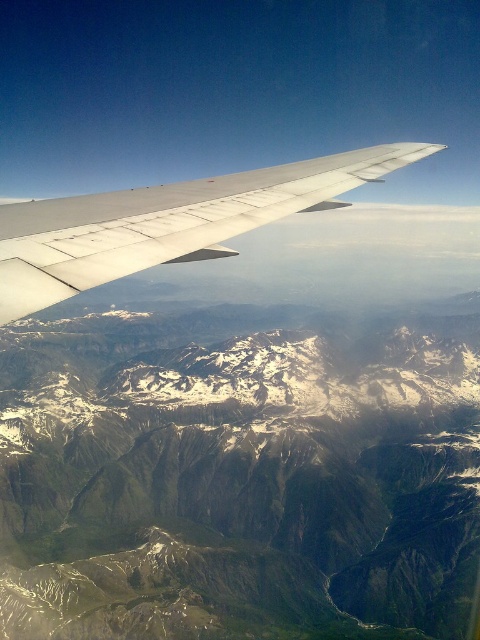
Which of these two, snowy rocky mountains at upper center or silver metallic wing at upper center, stands shorter?

silver metallic wing at upper center

Does point (201, 496) lie in front of point (144, 264)?

No, (201, 496) is further to viewer.

This screenshot has height=640, width=480. Find the location of `snowy rocky mountains at upper center`. snowy rocky mountains at upper center is located at coordinates [x=238, y=472].